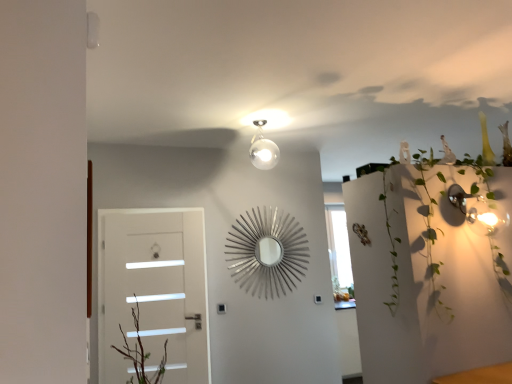
Question: Can you confirm if white glossy door at left is thinner than green leafy plant at upper right?

Choices:
 (A) no
 (B) yes

Answer: (B)

Question: Is white glossy door at left at the left side of green leafy plant at upper right?

Choices:
 (A) no
 (B) yes

Answer: (B)

Question: From a real-world perspective, is white glossy door at left on green leafy plant at upper right?

Choices:
 (A) no
 (B) yes

Answer: (A)

Question: Are white glossy door at left and green leafy plant at upper right far apart?

Choices:
 (A) yes
 (B) no

Answer: (A)

Question: From the image's perspective, is white glossy door at left beneath green leafy plant at upper right?

Choices:
 (A) yes
 (B) no

Answer: (A)

Question: Does white glossy door at left have a greater height compared to green leafy plant at upper right?

Choices:
 (A) no
 (B) yes

Answer: (B)

Question: Is white glossy door at left inside green leafy plant at upper right?

Choices:
 (A) yes
 (B) no

Answer: (B)

Question: Are green leafy plant at upper right and white glossy door at left located far from each other?

Choices:
 (A) yes
 (B) no

Answer: (A)

Question: Is green leafy plant at upper right oriented away from white glossy door at left?

Choices:
 (A) no
 (B) yes

Answer: (A)

Question: Does green leafy plant at upper right have a smaller size compared to white glossy door at left?

Choices:
 (A) yes
 (B) no

Answer: (B)

Question: From a real-world perspective, is green leafy plant at upper right located higher than white glossy door at left?

Choices:
 (A) no
 (B) yes

Answer: (B)

Question: From the image's perspective, is green leafy plant at upper right located above white glossy door at left?

Choices:
 (A) yes
 (B) no

Answer: (A)

Question: In terms of height, does white glossy door at left look taller or shorter compared to green leafy plant at upper right?

Choices:
 (A) short
 (B) tall

Answer: (B)